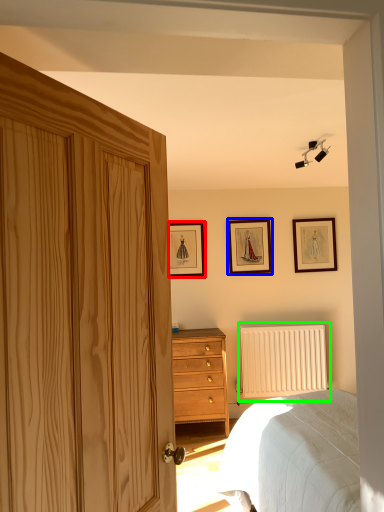
Question: Which is farther away from picture frame (highlighted by a red box)? picture frame (highlighted by a blue box) or radiator (highlighted by a green box)?

Choices:
 (A) picture frame
 (B) radiator

Answer: (B)